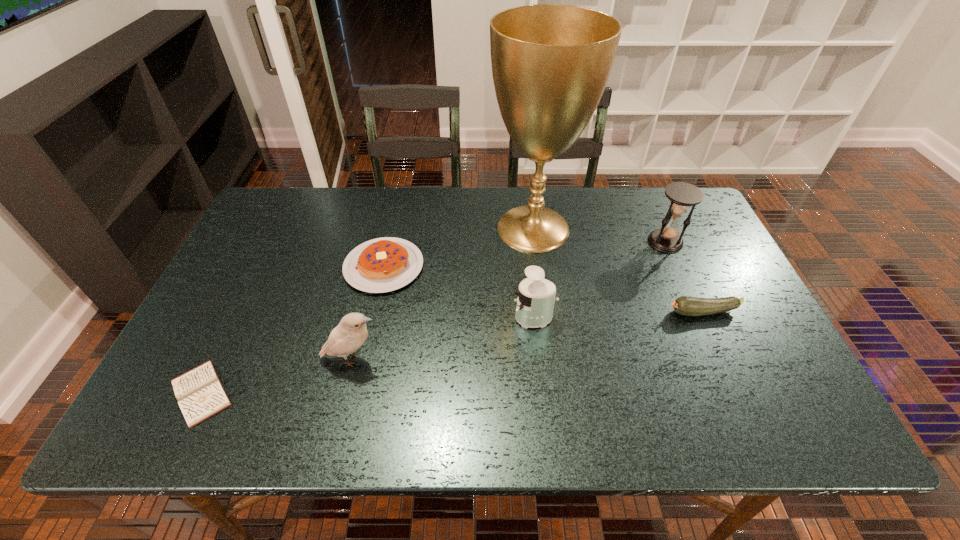
You are a GUI agent. You are given a task and a screenshot of the screen. Output one action in this format:
    pyautogui.click(x=<x>, y=<y>)
    Task: Click on the object that stands as the fifth closest to the hourglass
    The height and width of the screenshot is (540, 960).
    Given the screenshot: What is the action you would take?
    pyautogui.click(x=351, y=333)

This screenshot has width=960, height=540. Find the location of `object that ranks as the third closest to the bird`. object that ranks as the third closest to the bird is located at coordinates (536, 296).

What are the coordinates of `free region that satisfies the following two spatial constraints: 1. on the back side of the shortest object; 2. on the left side of the pancake` in the screenshot? It's located at (262, 267).

This screenshot has height=540, width=960. I want to click on vacant space that satisfies the following two spatial constraints: 1. on the back side of the hourglass; 2. on the right side of the pancake, so click(389, 241).

Find the location of a particular element. Image resolution: width=960 pixels, height=540 pixels. free space that satisfies the following two spatial constraints: 1. on the back side of the hourglass; 2. on the right side of the shortest object is located at coordinates (275, 241).